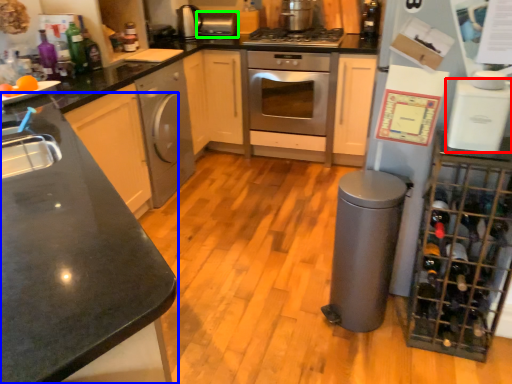
Question: Which object is positioned farthest from kitchen appliance (highlighted by a red box)? Select from countertop (highlighted by a blue box) and appliance (highlighted by a green box).

Choices:
 (A) countertop
 (B) appliance

Answer: (B)